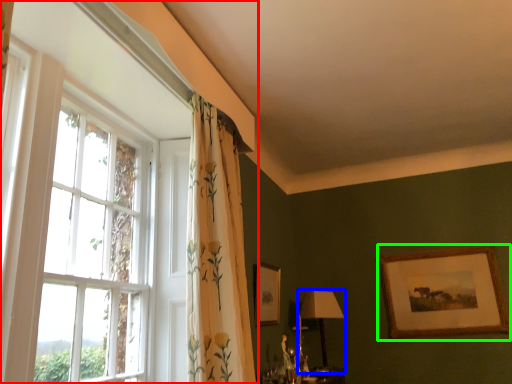
Question: Estimate the real-world distances between objects in this image. Which object is farther from window (highlighted by a red box), table lamp (highlighted by a blue box) or picture frame (highlighted by a green box)?

Choices:
 (A) table lamp
 (B) picture frame

Answer: (B)